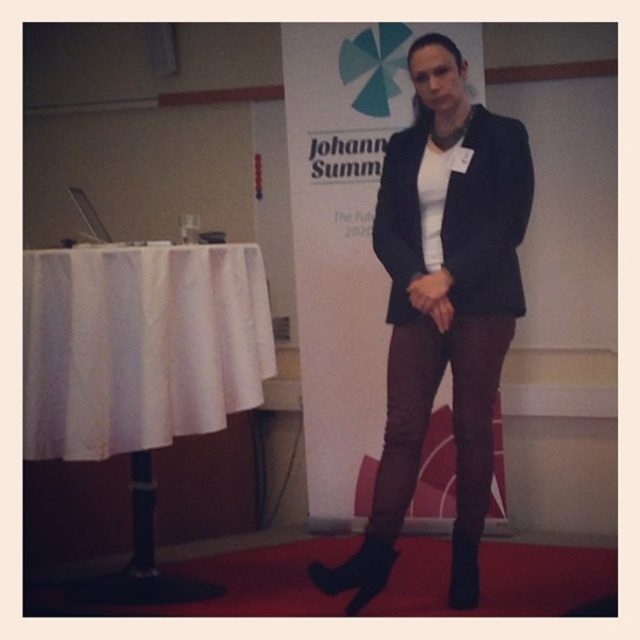
Does black matte blazer at center appear on the left side of white cloth at left?

No, black matte blazer at center is not to the left of white cloth at left.

From the picture: Is black matte blazer at center above white cloth at left?

Yes.

Is point (419, 38) in front of point (164, 269)?

No, it is behind (164, 269).

You are a GUI agent. You are given a task and a screenshot of the screen. Output one action in this format:
    pyautogui.click(x=<x>, y=<y>)
    Task: Click on the black matte blazer at center
    Image resolution: width=640 pixels, height=640 pixels.
    Given the screenshot: What is the action you would take?
    pyautogui.click(x=442, y=305)